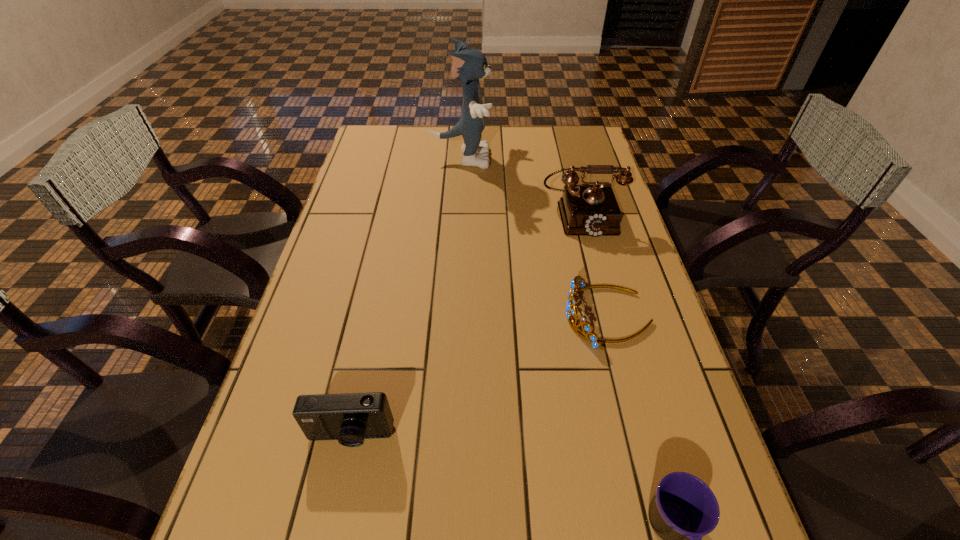
This screenshot has width=960, height=540. In order to click on free spot between the camera and the cat in this screenshot , I will do `click(405, 298)`.

Identify the location of vacant point located between the farthest object and the third farthest object. (534, 237).

The width and height of the screenshot is (960, 540). In order to click on free space between the telephone and the third nearest object in this screenshot , I will do `click(594, 266)`.

Find the location of `free spot between the second nearest object and the tiara`. free spot between the second nearest object and the tiara is located at coordinates (479, 376).

In order to click on free point between the fourth farthest object and the cat in this screenshot , I will do `click(405, 298)`.

This screenshot has height=540, width=960. Identify the location of object that stands as the third closest to the third farthest object. click(x=350, y=418).

At what (x,y) coordinates should I click in order to perform the action: click on object that stands as the second closest to the fourth farthest object. Please return your answer as a coordinate pair (x, y). The height and width of the screenshot is (540, 960). Looking at the image, I should click on (683, 509).